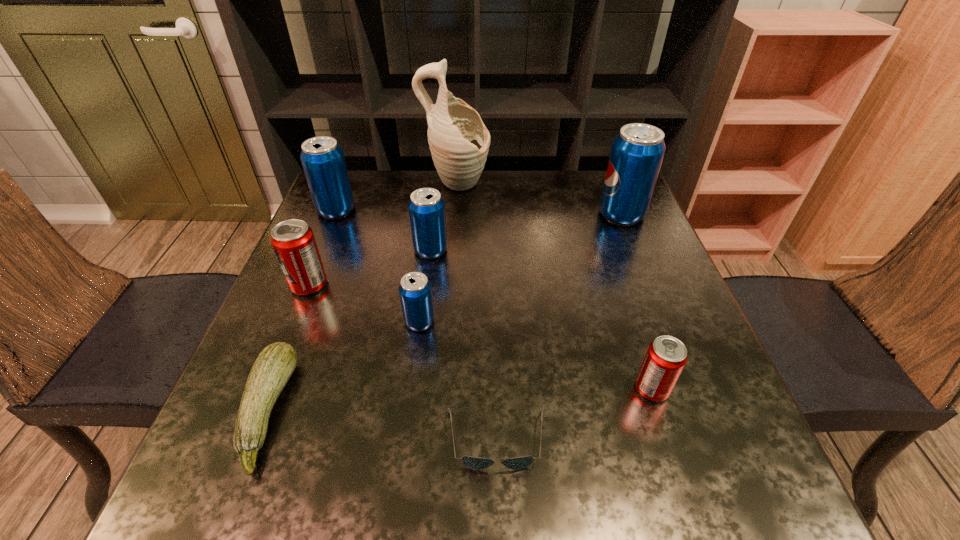
Image resolution: width=960 pixels, height=540 pixels. I want to click on vacant space located on the right of the second nearest blue pop soda, so [x=541, y=250].

At what (x,y) coordinates should I click in order to perform the action: click on free space located 0.050m on the front of the fifth nearest object. Please return your answer as a coordinate pair (x, y). Looking at the image, I should click on (297, 315).

Find the location of a particular element. vacant area situated 0.100m on the left of the fourth nearest object is located at coordinates (356, 322).

Image resolution: width=960 pixels, height=540 pixels. I want to click on free space located 0.080m on the front of the nearer red soda can, so click(x=671, y=448).

The image size is (960, 540). Find the location of `free space located 0.250m at the stem end of the eighth tallest object`. free space located 0.250m at the stem end of the eighth tallest object is located at coordinates (432, 411).

You are a GUI agent. You are given a task and a screenshot of the screen. Output one action in this format:
    pyautogui.click(x=<x>, y=<y>)
    Task: Click on the pitcher positioned at the far edge
    The height and width of the screenshot is (540, 960).
    Given the screenshot: What is the action you would take?
    pyautogui.click(x=459, y=142)

Where is `zucchini situated at the near edge`? The width and height of the screenshot is (960, 540). zucchini situated at the near edge is located at coordinates (273, 367).

This screenshot has width=960, height=540. I want to click on sunglasses that is positioned at the near edge, so (x=476, y=463).

Where is `zucchini that is at the left edge`? This screenshot has height=540, width=960. zucchini that is at the left edge is located at coordinates (273, 367).

I want to click on object located at the far left corner, so click(x=323, y=161).